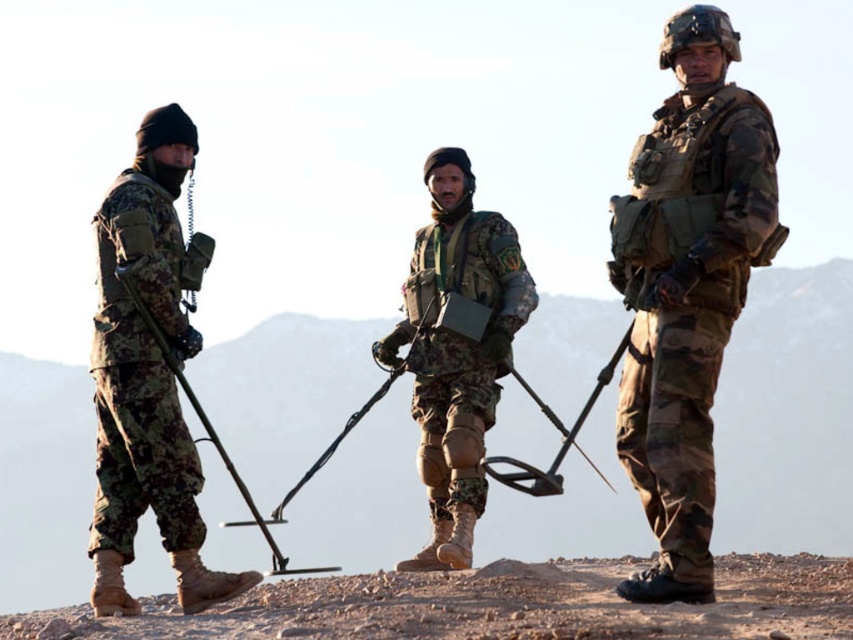
Question: Which point appears farthest from the camera in this image?

Choices:
 (A) (430, 458)
 (B) (666, 428)
 (C) (106, 332)

Answer: (A)

Question: Is the position of camouflage fabric uniform at left more distant than that of camouflage fabric vest at center?

Choices:
 (A) no
 (B) yes

Answer: (A)

Question: Is camo fabric uniform at right positioned at the back of camouflage fabric vest at center?

Choices:
 (A) no
 (B) yes

Answer: (A)

Question: Which point is closer to the camera?

Choices:
 (A) camouflage fabric vest at center
 (B) camo fabric uniform at right
 (C) camouflage fabric uniform at left

Answer: (B)

Question: Does camo fabric uniform at right appear on the right side of camouflage fabric uniform at left?

Choices:
 (A) no
 (B) yes

Answer: (B)

Question: Which object is closer to the camera taking this photo?

Choices:
 (A) camo fabric uniform at right
 (B) camouflage fabric vest at center

Answer: (A)